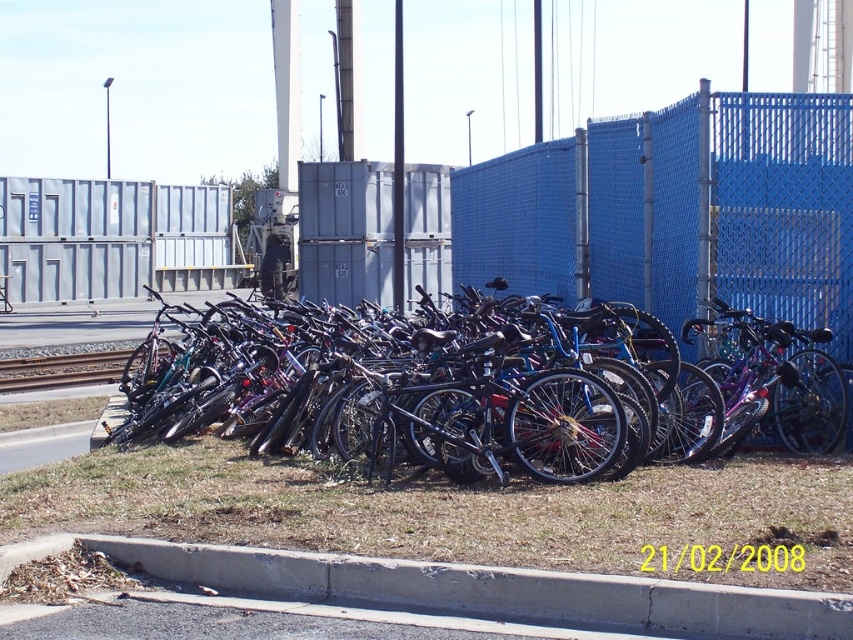
You are standing in front of the blue mesh fence at center and the brushed metal train track at left. Which object is nearer to you?

The blue mesh fence at center is closer to the viewer than the brushed metal train track at left, so the blue mesh fence at center is nearer to you.

You are a delivery person trying to navigate through the bike storage area. You need to move from the blue mesh fence at center to the brushed metal train track at left. Which direction should you move to reach the train track?

The blue mesh fence at center is positioned on the right side of the brushed metal train track at left, so you should move to the left to reach the train track.

Consider the image. You are a delivery person needing to cross from the pile of bikes to the blue mesh fence at center. The train is approaching on the brushed metal train track at left. If you start moving towards the fence when the train is 10 meters away from the track, will you have enough time to reach the fence before the train arrives?

The blue mesh fence at center is 8.59 meters away from the brushed metal train track at left. If the train is 10 meters away from the track when you start moving, you have enough time to reach the fence before the train arrives since the distance to the fence is less than the train distance.